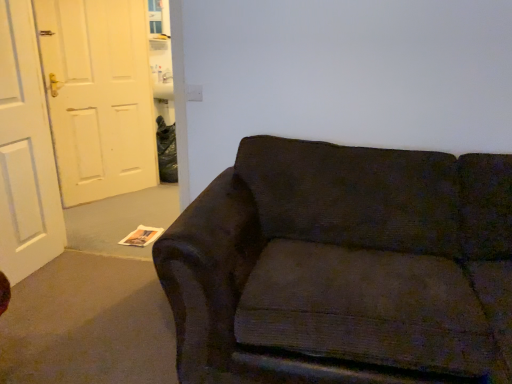
Locate an element on the screen. The image size is (512, 384). white matte door at left, which is counted as the second door, starting from the front is located at coordinates (98, 96).

Is dark fabric couch at center behind white matte door at left, the first door in the front-to-back sequence?

No, it is not.

From a real-world perspective, which door is the 1st one above the dark fabric couch at center? Please provide its 2D coordinates.

[(25, 151)]

Is dark fabric couch at center inside the boundaries of white matte door at left, arranged as the second door when viewed from the back, or outside?

dark fabric couch at center is not enclosed by white matte door at left, arranged as the second door when viewed from the back.

Which object is positioned more to the left, dark fabric couch at center or white matte door at left, the first door in the front-to-back sequence?

From the viewer's perspective, white matte door at left, the first door in the front-to-back sequence, appears more on the left side.

Choose the correct answer: Is white matte door at left, the 1th door positioned from the back, inside white matte door at left, arranged as the second door when viewed from the back, or outside it?

white matte door at left, the 1th door positioned from the back, is located beyond the bounds of white matte door at left, arranged as the second door when viewed from the back.

Considering the sizes of objects white matte door at left, which is counted as the second door, starting from the front, and white matte door at left, arranged as the second door when viewed from the back, in the image provided, who is bigger, white matte door at left, which is counted as the second door, starting from the front, or white matte door at left, arranged as the second door when viewed from the back,?

white matte door at left, which is counted as the second door, starting from the front, is bigger.

From a real-world perspective, who is located higher, white matte door at left, the 1th door positioned from the back, or white matte door at left, arranged as the second door when viewed from the back?

From a 3D spatial view, white matte door at left, the 1th door positioned from the back, is above.

Would you say white matte door at left, the 1th door positioned from the back, is to the left or to the right of white matte door at left, the first door in the front-to-back sequence, in the picture?

From the image, it's evident that white matte door at left, the 1th door positioned from the back, is to the right of white matte door at left, the first door in the front-to-back sequence.

Does white matte door at left, the first door in the front-to-back sequence, have a smaller size compared to dark fabric couch at center?

Yes, white matte door at left, the first door in the front-to-back sequence, is smaller than dark fabric couch at center.

In the scene shown: Is dark fabric couch at center at the back of white matte door at left, arranged as the second door when viewed from the back?

No, white matte door at left, arranged as the second door when viewed from the back, is not facing the opposite direction of dark fabric couch at center.

Consider the image. Which object is positioned more to the right, white matte door at left, arranged as the second door when viewed from the back, or dark fabric couch at center?

dark fabric couch at center.

Is white matte door at left, the first door in the front-to-back sequence, taller or shorter than dark fabric couch at center?

Considering their sizes, white matte door at left, the first door in the front-to-back sequence, has more height than dark fabric couch at center.

Considering the sizes of objects white matte door at left, the first door in the front-to-back sequence, and white matte door at left, the 1th door positioned from the back, in the image provided, who is wider, white matte door at left, the first door in the front-to-back sequence, or white matte door at left, the 1th door positioned from the back,?

With larger width is white matte door at left, the 1th door positioned from the back.

How different are the orientations of white matte door at left, the first door in the front-to-back sequence, and white matte door at left, which is counted as the second door, starting from the front, in degrees?

The angular difference between white matte door at left, the first door in the front-to-back sequence, and white matte door at left, which is counted as the second door, starting from the front, is 29.9 degrees.

Is white matte door at left, the first door in the front-to-back sequence, not close to white matte door at left, which is counted as the second door, starting from the front?

No, white matte door at left, the first door in the front-to-back sequence, is not far from white matte door at left, which is counted as the second door, starting from the front.

Is point (15, 71) farther from camera compared to point (74, 39)?

No, (15, 71) is in front of (74, 39).

Which is behind, dark fabric couch at center or white matte door at left, the 1th door positioned from the back?

Positioned behind is white matte door at left, the 1th door positioned from the back.

From the image's perspective, which is above, dark fabric couch at center or white matte door at left, the 1th door positioned from the back?

white matte door at left, the 1th door positioned from the back, appears higher in the image.

Is point (361, 208) in front of point (119, 35)?

Yes, point (361, 208) is in front of point (119, 35).

Is white matte door at left, which is counted as the second door, starting from the front, at the left side of dark fabric couch at center?

Yes, white matte door at left, which is counted as the second door, starting from the front, is to the left of dark fabric couch at center.

Between white matte door at left, the 1th door positioned from the back, and dark fabric couch at center, which one has smaller size?

white matte door at left, the 1th door positioned from the back.

Locate an element on the screen. The image size is (512, 384). the 1st door directly above the dark fabric couch at center (from a real-world perspective) is located at coordinates (25, 151).

I want to click on door located on the right of white matte door at left, the first door in the front-to-back sequence, so (x=98, y=96).

From the image, which object appears to be farther from dark fabric couch at center, white matte door at left, which is counted as the second door, starting from the front, or white matte door at left, arranged as the second door when viewed from the back?

The object further to dark fabric couch at center is white matte door at left, which is counted as the second door, starting from the front.

Based on the photo, estimate the real-world distances between objects in this image. Which object is closer to white matte door at left, arranged as the second door when viewed from the back, white matte door at left, which is counted as the second door, starting from the front, or dark fabric couch at center?

Based on the image, white matte door at left, which is counted as the second door, starting from the front, appears to be nearer to white matte door at left, arranged as the second door when viewed from the back.

Estimate the real-world distances between objects in this image. Which object is further from white matte door at left, which is counted as the second door, starting from the front, dark fabric couch at center or white matte door at left, arranged as the second door when viewed from the back?

dark fabric couch at center.

Looking at the image, which one is located further to dark fabric couch at center, white matte door at left, arranged as the second door when viewed from the back, or white matte door at left, which is counted as the second door, starting from the front?

white matte door at left, which is counted as the second door, starting from the front, is further to dark fabric couch at center.

Looking at the image, which one is located closer to white matte door at left, the 1th door positioned from the back, white matte door at left, the first door in the front-to-back sequence, or dark fabric couch at center?

The object closer to white matte door at left, the 1th door positioned from the back, is white matte door at left, the first door in the front-to-back sequence.

Based on their spatial positions, is dark fabric couch at center or white matte door at left, the 1th door positioned from the back, further from white matte door at left, arranged as the second door when viewed from the back?

The object further to white matte door at left, arranged as the second door when viewed from the back, is dark fabric couch at center.

Identify the location of door between dark fabric couch at center and white matte door at left, which is counted as the second door, starting from the front, in the front-back direction. (25, 151).